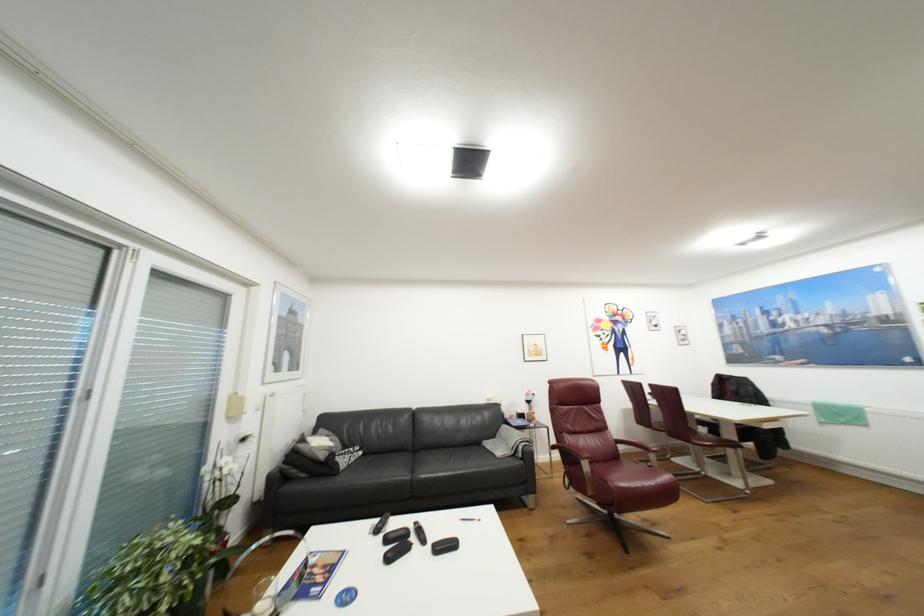
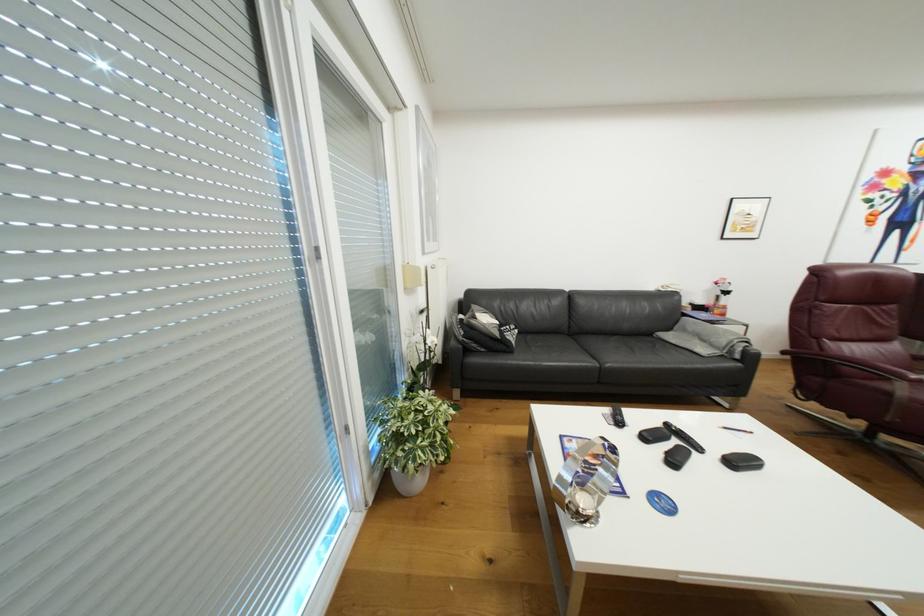
Which direction would the cameraman need to move to produce the second image?

The movement direction of the cameraman is left, forward.